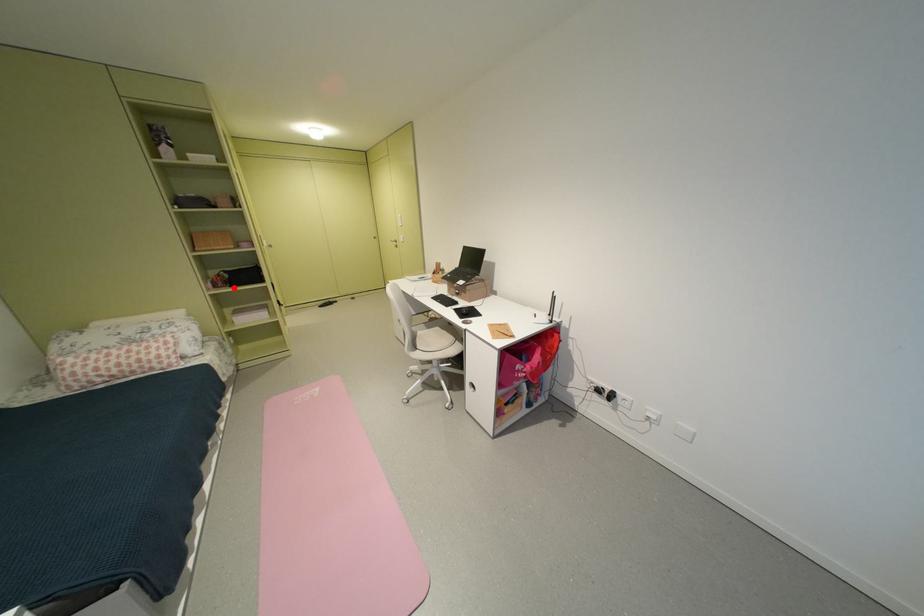
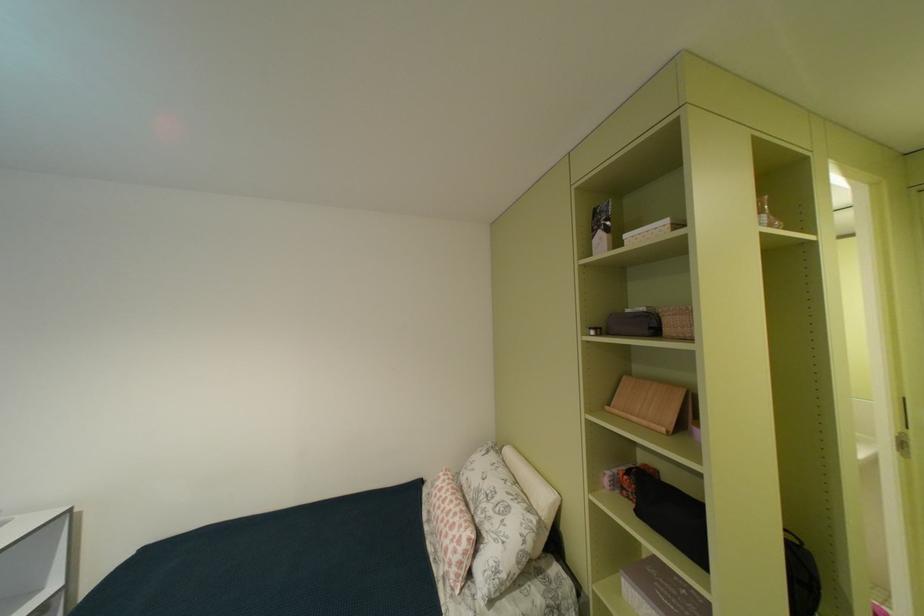
In the second image, find the point that corresponds to the highlighted location in the first image.

(641, 501)